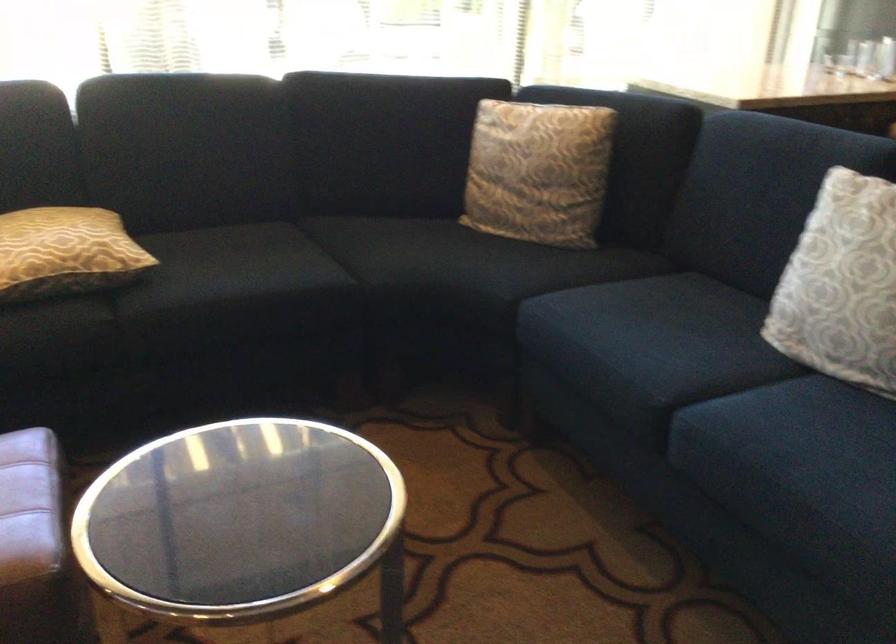
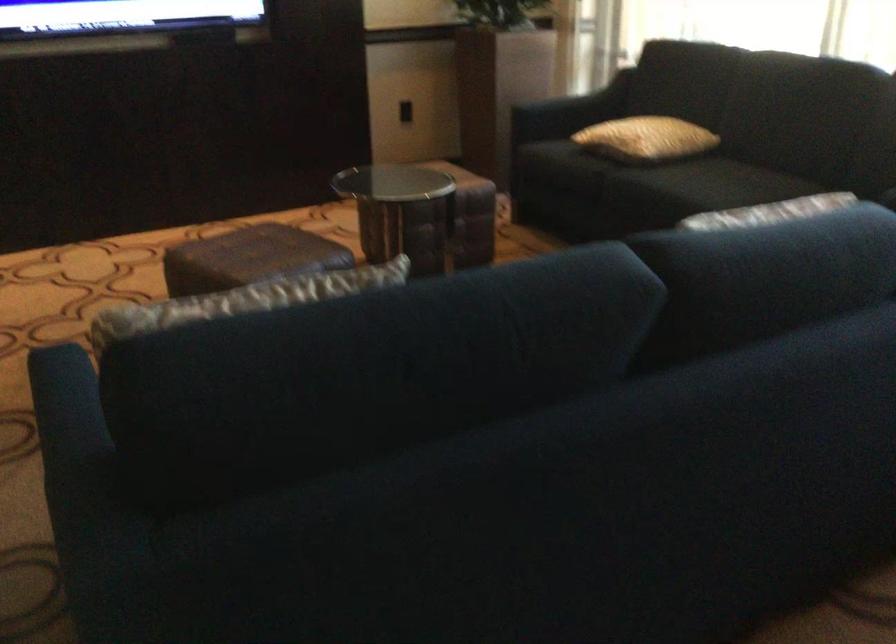
Question: I am providing you with two images of the same scene from different viewpoints. After the viewpoint changes to image2, which objects are now occluded?

Choices:
 (A) sofa sitting surface
 (B) yellow pillow
 (C) white pot lid
 (D) dark sofa armrest

Answer: (A)